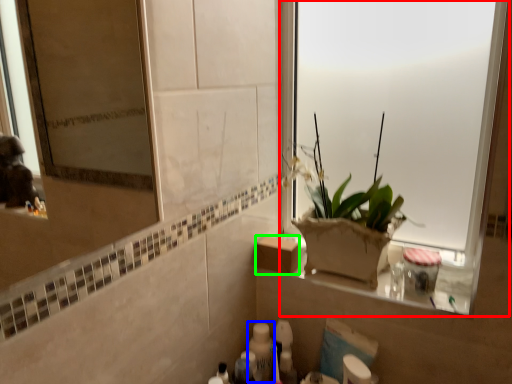
Question: Considering the real-world distances, which object is farthest from window (highlighted by a red box)? toiletry (highlighted by a blue box) or cardboard box (highlighted by a green box)?

Choices:
 (A) toiletry
 (B) cardboard box

Answer: (A)